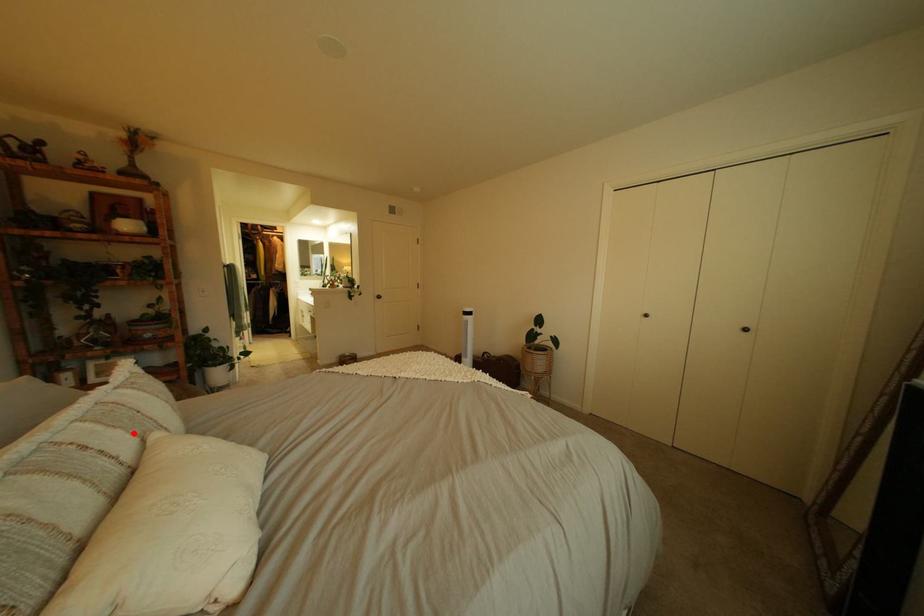
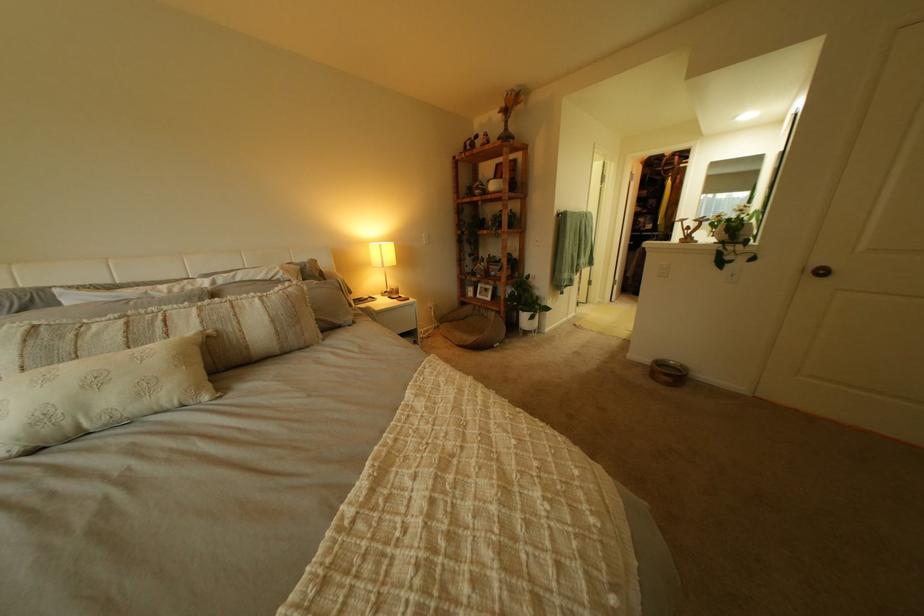
Find the pixel in the second image that matches the highlighted location in the first image.

(213, 323)